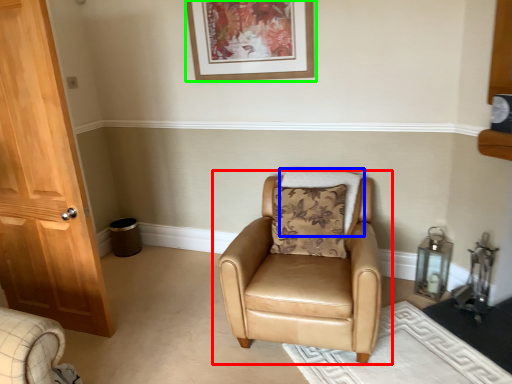
Question: Which is farther away from chair (highlighted by a red box)? pillow (highlighted by a blue box) or picture frame (highlighted by a green box)?

Choices:
 (A) pillow
 (B) picture frame

Answer: (B)